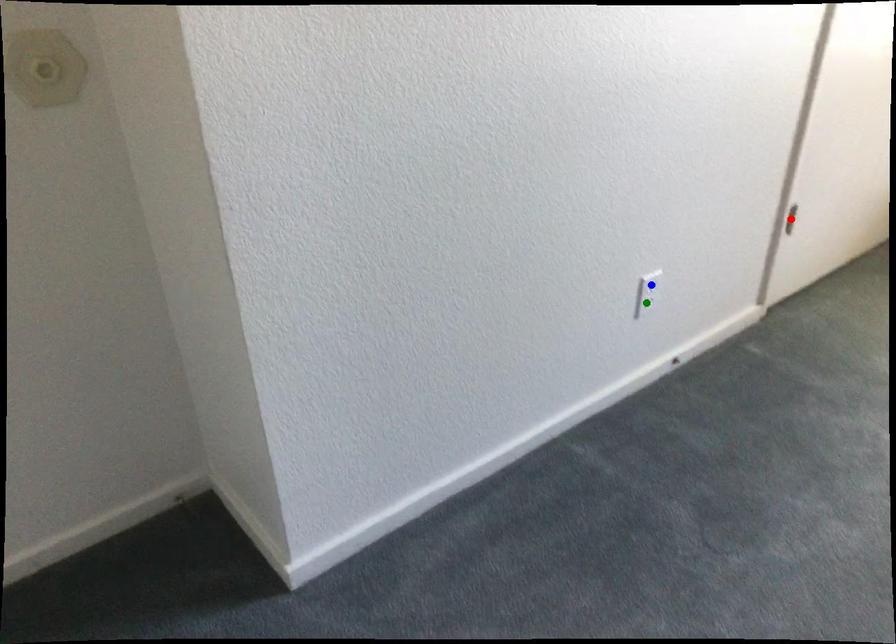
Order these from farthest to nearest:
red point
green point
blue point

red point, green point, blue point